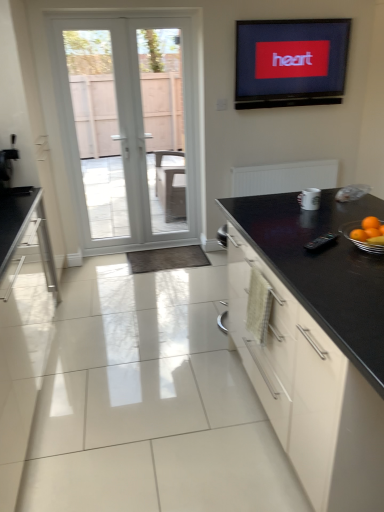
Locate an element on the screen. The image size is (384, 512). free space on the front side of black plastic remote control at center, placed as the first appliance when sorted from bottom to top is located at coordinates (339, 259).